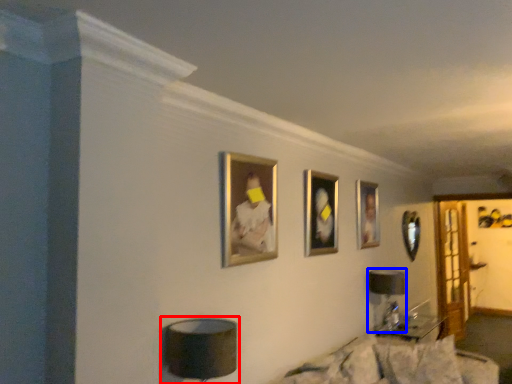
Question: Which object appears farthest to the camera in this image, table lamp (highlighted by a red box) or table lamp (highlighted by a blue box)?

Choices:
 (A) table lamp
 (B) table lamp

Answer: (B)